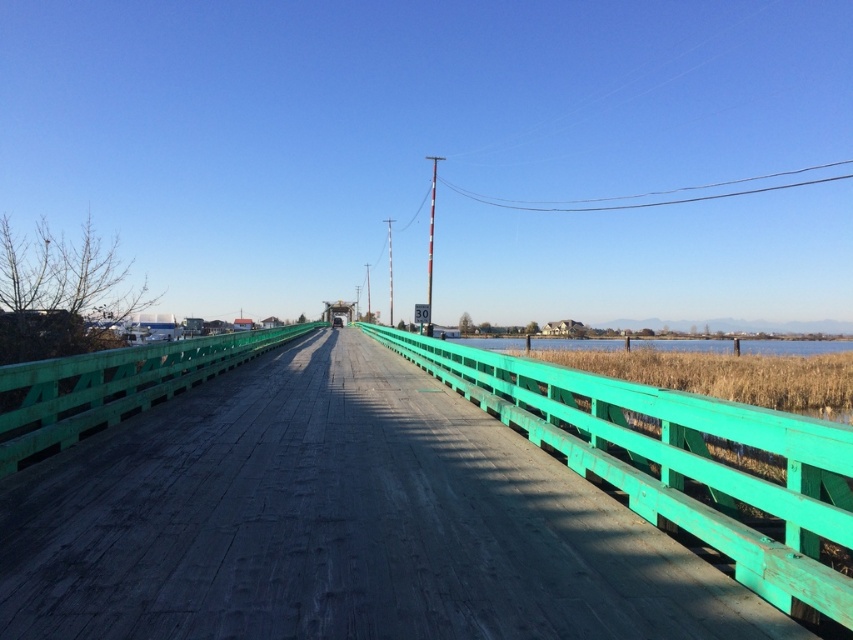
Is point (392, 481) in front of point (827, 352)?

Yes, it is in front of point (827, 352).

Does green wooden bridge at center appear under green wooden water at center?

Incorrect, green wooden bridge at center is not positioned below green wooden water at center.

Is point (625, 577) closer to camera compared to point (583, 340)?

That is True.

The width and height of the screenshot is (853, 640). What are the coordinates of `green wooden bridge at center` in the screenshot? It's located at (340, 524).